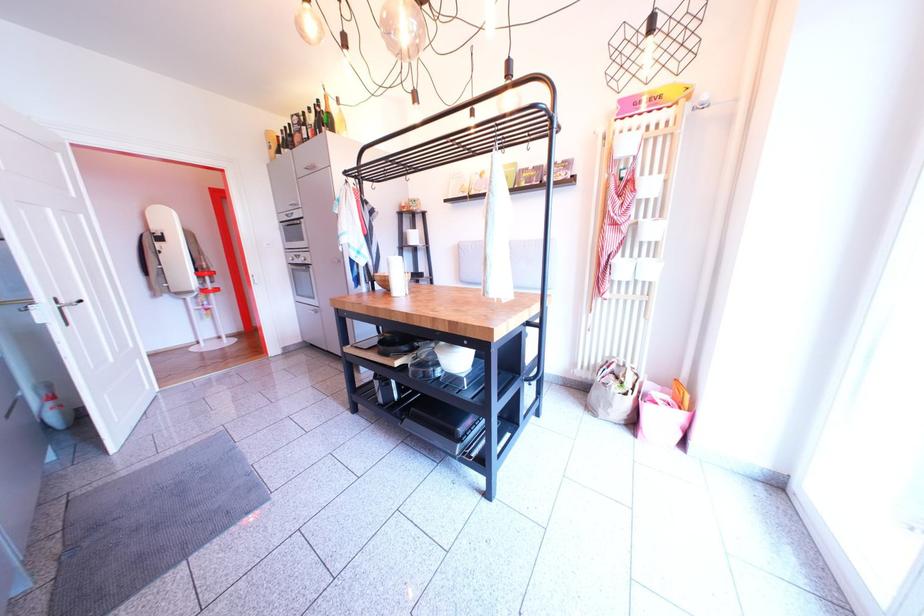
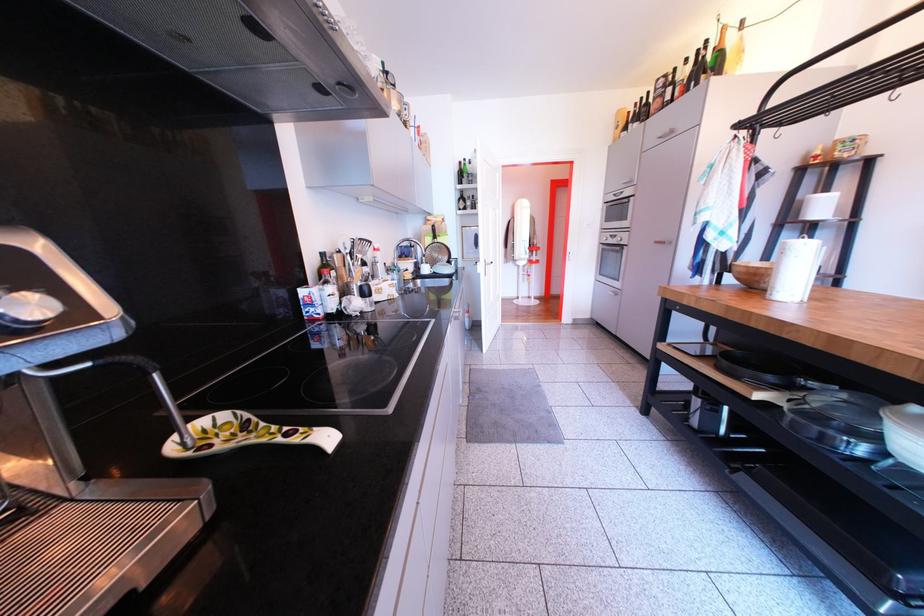
Locate, in the second image, the point that corresponds to point (418, 240) in the first image.

(813, 208)